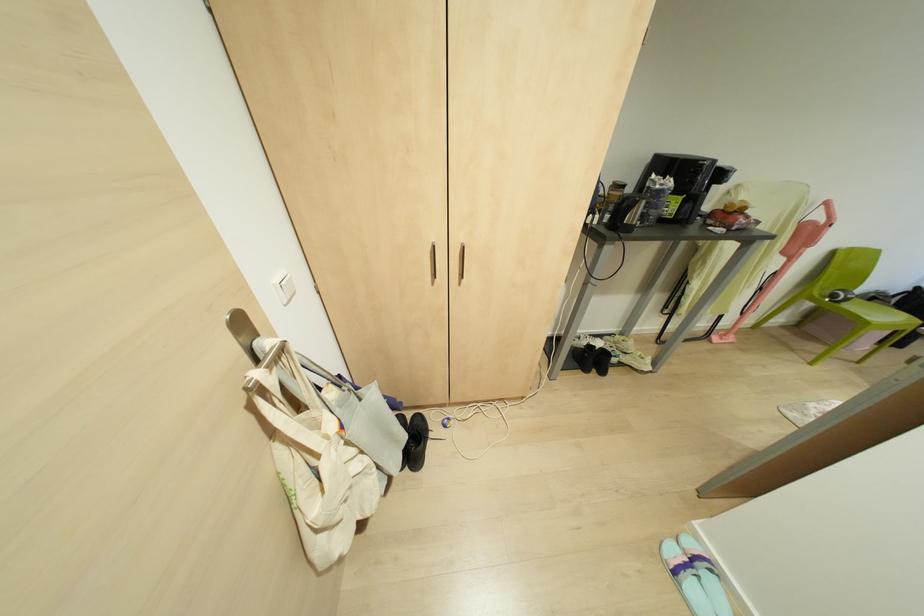
What do you see at coordinates (633, 217) in the screenshot? The image size is (924, 616). I see `a kettle handle` at bounding box center [633, 217].